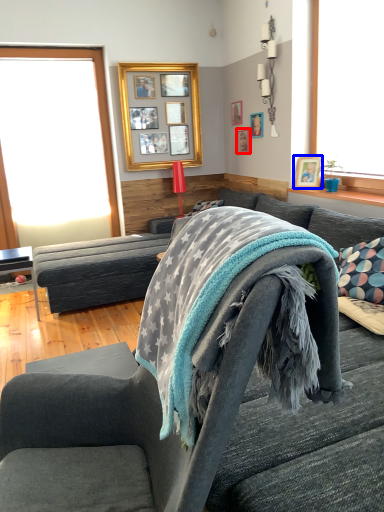
Question: Which point is closer to the camera, picture frame (highlighted by a red box) or picture frame (highlighted by a blue box)?

Choices:
 (A) picture frame
 (B) picture frame

Answer: (B)